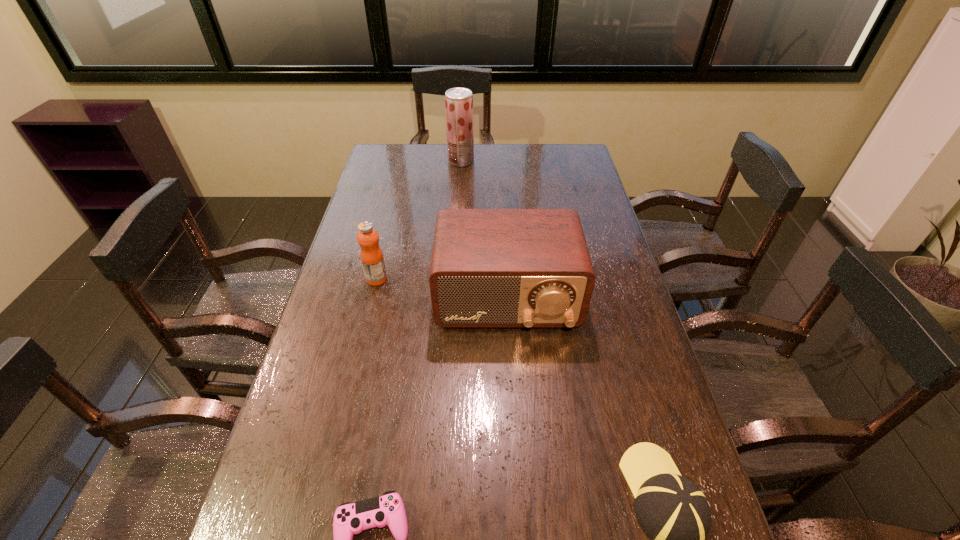
The height and width of the screenshot is (540, 960). In order to click on the taller fruit juice in this screenshot , I will do `click(458, 101)`.

Where is `the tallest object`? the tallest object is located at coordinates (458, 101).

The width and height of the screenshot is (960, 540). In order to click on radio receiver in this screenshot , I will do `click(490, 267)`.

This screenshot has width=960, height=540. I want to click on the left fruit juice, so click(371, 255).

Where is `the shorter fruit juice`? the shorter fruit juice is located at coordinates (371, 255).

At what (x,y) coordinates should I click in order to perform the action: click on free spot located on the front of the tallest object. Please return your answer as a coordinate pair (x, y). The height and width of the screenshot is (540, 960). Looking at the image, I should click on (459, 188).

Find the location of a particular element. This screenshot has height=540, width=960. vacant space located 0.270m on the front panel of the radio receiver is located at coordinates (515, 431).

This screenshot has width=960, height=540. In order to click on free space located on the left of the left fruit juice in this screenshot , I will do pyautogui.click(x=347, y=279).

This screenshot has width=960, height=540. I want to click on object at the far edge, so click(458, 101).

You are a GUI agent. You are given a task and a screenshot of the screen. Output one action in this format:
    pyautogui.click(x=<x>, y=<y>)
    Task: Click on the object at the left edge
    This screenshot has width=960, height=540.
    Given the screenshot: What is the action you would take?
    pyautogui.click(x=371, y=255)